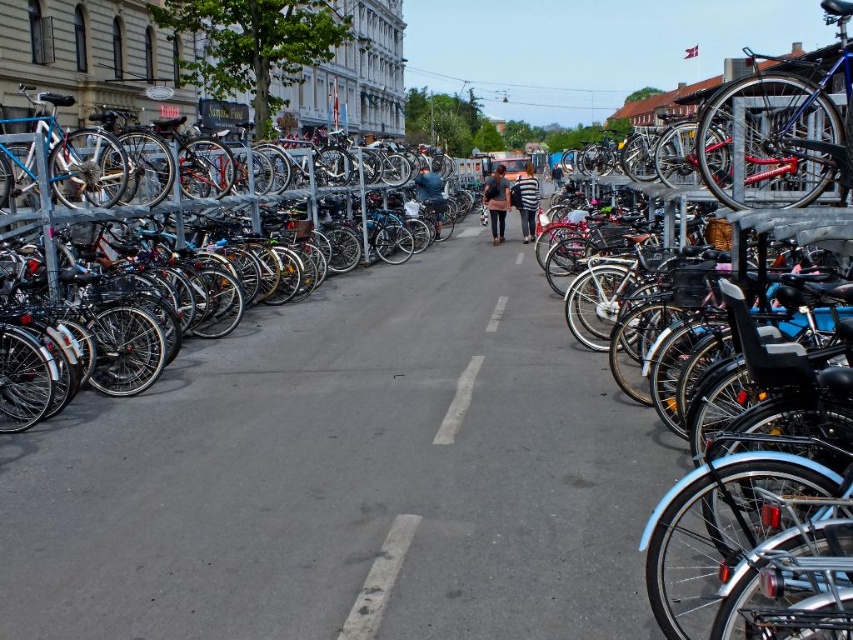
Question: Which of the following is the farthest from the observer?

Choices:
 (A) (787, 93)
 (B) (143, 378)

Answer: (B)

Question: Is shiny metallic bicycle at left above dark blue jeans at center?

Choices:
 (A) no
 (B) yes

Answer: (A)

Question: Is shiny metallic bicycle at left to the right of dark gray sweater at center from the viewer's perspective?

Choices:
 (A) no
 (B) yes

Answer: (A)

Question: Can you confirm if white asphalt road at center is bigger than dark gray sweater at center?

Choices:
 (A) yes
 (B) no

Answer: (B)

Question: Among these points, which one is farthest from the camera?

Choices:
 (A) (558, 163)
 (B) (482, 195)
 (C) (699, 132)
 (D) (427, 177)

Answer: (A)

Question: Which of the following is the closest to the observer?

Choices:
 (A) (158, 230)
 (B) (494, 214)
 (C) (380, 580)

Answer: (C)